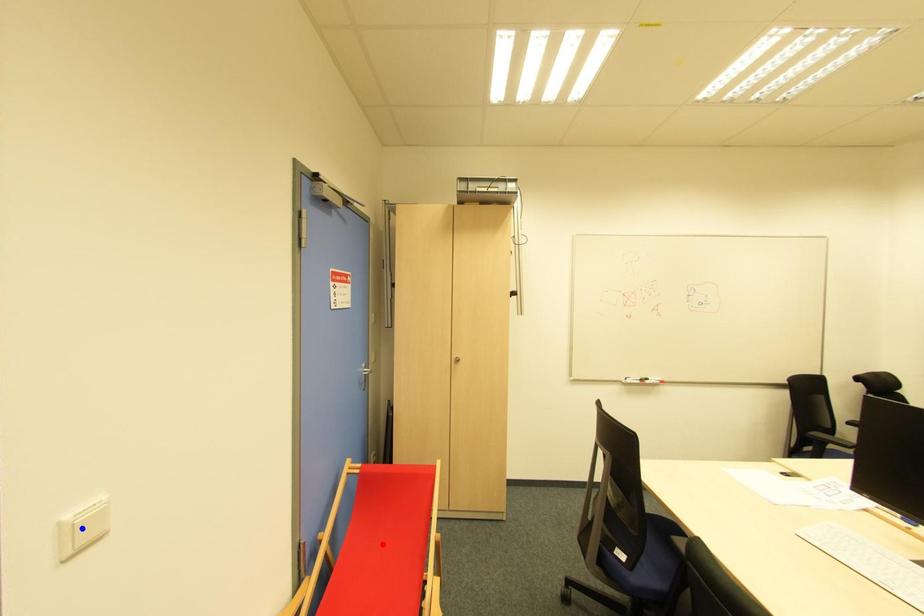
Question: Two points are marked on the image. Which point is closer to the camera?

Choices:
 (A) Blue point is closer.
 (B) Red point is closer.

Answer: (A)